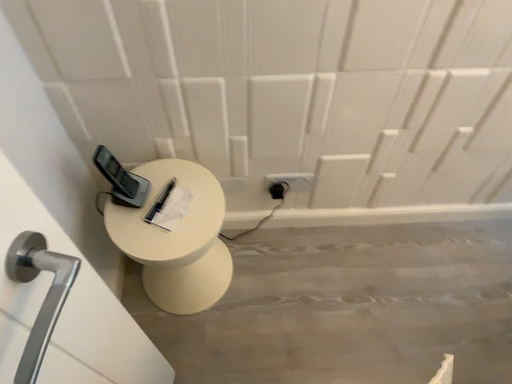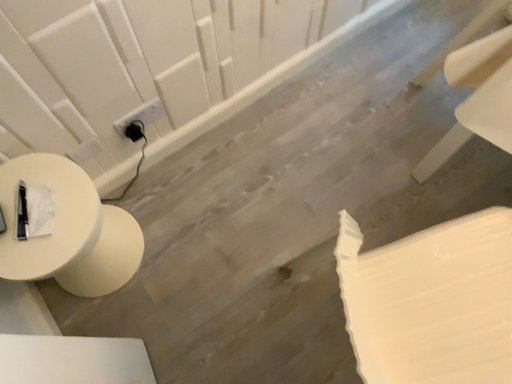
Question: Which way did the camera rotate in the video?

Choices:
 (A) rotated left
 (B) rotated right

Answer: (B)